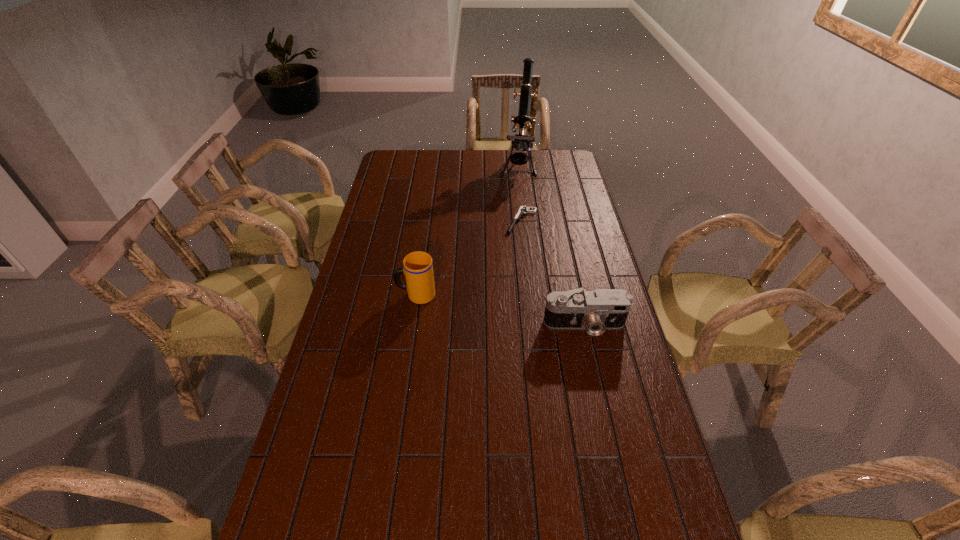
The height and width of the screenshot is (540, 960). In order to click on the second tallest object in this screenshot , I will do `click(418, 266)`.

This screenshot has height=540, width=960. I want to click on the second nearest object, so click(418, 266).

Identify the location of the nearest object. (595, 311).

Locate an element on the screen. camera is located at coordinates (595, 311).

Locate an element on the screen. the third nearest object is located at coordinates (523, 209).

Image resolution: width=960 pixels, height=540 pixels. I want to click on pistol, so click(x=523, y=209).

At what (x,y) coordinates should I click in order to perform the action: click on the farthest object. Please return your answer as a coordinate pair (x, y). The image size is (960, 540). Looking at the image, I should click on (521, 142).

I want to click on microscope, so click(x=521, y=142).

Identify the location of vacant position located 0.140m on the side of the leftmost object with the handle. This screenshot has width=960, height=540. (356, 295).

This screenshot has width=960, height=540. I want to click on vacant space located 0.050m on the lens of the nearest object, so click(591, 353).